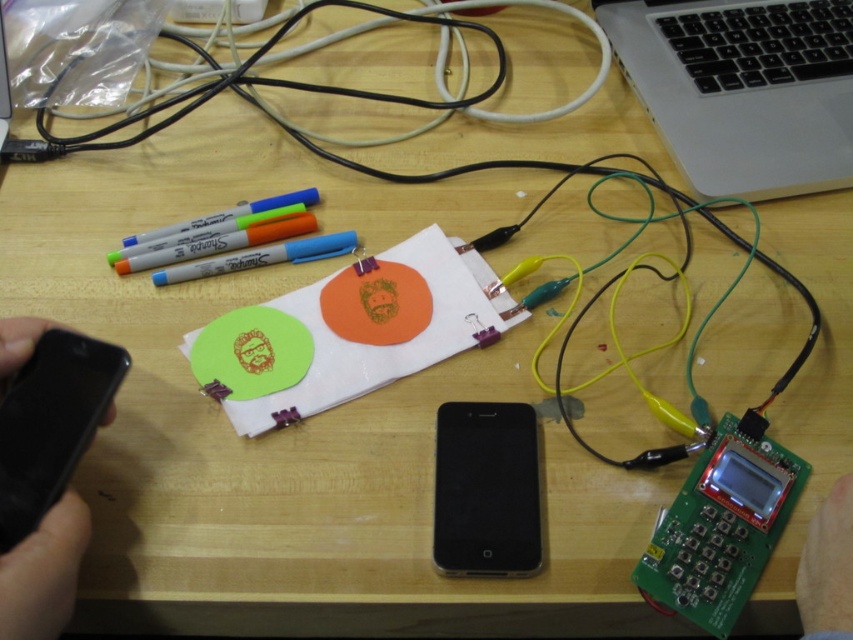
Question: Which point is farther from the camera taking this photo?

Choices:
 (A) (844, 627)
 (B) (647, 0)

Answer: (B)

Question: Can you confirm if black matte phone at left is positioned below skinny white hand at lower right?

Choices:
 (A) yes
 (B) no

Answer: (B)

Question: Can you confirm if black matte smartphone at center is bigger than black matte phone at left?

Choices:
 (A) yes
 (B) no

Answer: (B)

Question: Which point is farther to the camera?

Choices:
 (A) black matte smartphone at center
 (B) silver metallic laptop at upper right

Answer: (B)

Question: Where is black matte smartphone at center located in relation to black matte phone at left in the image?

Choices:
 (A) below
 (B) above

Answer: (A)

Question: Which point appears closest to the camera in this image?

Choices:
 (A) (813, 524)
 (B) (462, 481)
 (C) (605, 28)
 (D) (38, 593)

Answer: (D)